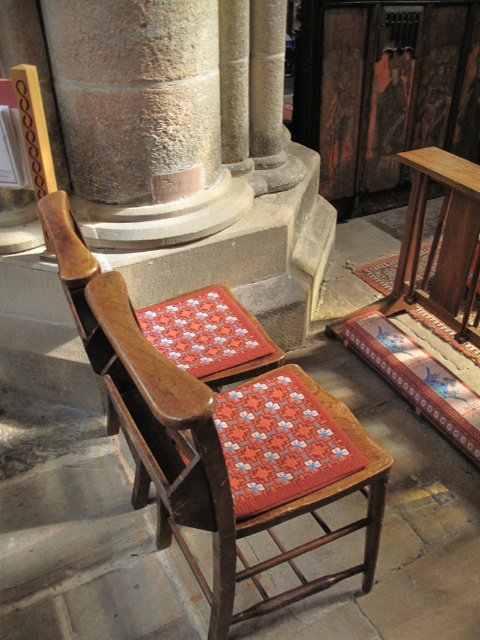
Question: Can you confirm if woven fabric cushion at center is wider than quilted orange fabric at center?

Choices:
 (A) no
 (B) yes

Answer: (B)

Question: Among these objects, which one is nearest to the camera?

Choices:
 (A) knitted woolen cushion at center
 (B) woven fabric cushion at center
 (C) quilted orange fabric at center

Answer: (B)

Question: In this image, where is woven fabric cushion at center located relative to quilted orange fabric at center?

Choices:
 (A) above
 (B) below

Answer: (B)

Question: Which object appears closest to the camera in this image?

Choices:
 (A) knitted woolen cushion at center
 (B) quilted orange fabric at center

Answer: (B)

Question: Is woven fabric cushion at center thinner than knitted woolen cushion at center?

Choices:
 (A) yes
 (B) no

Answer: (B)

Question: Which point appears closest to the camera in this image?

Choices:
 (A) (214, 516)
 (B) (183, 362)
 (C) (337, 433)

Answer: (A)